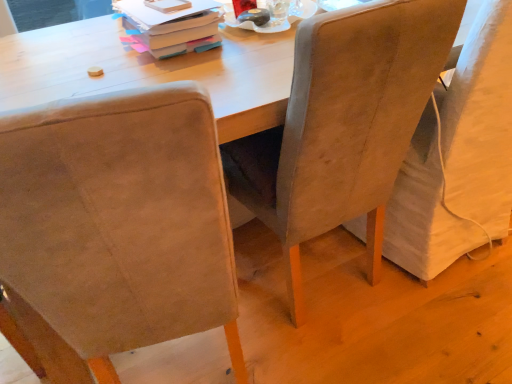
You are a GUI agent. You are given a task and a screenshot of the screen. Output one action in this format:
    pyautogui.click(x=<x>, y=<y>)
    Task: Click on the suede-like beige chair at left, placed as the 3th chair when sorted from right to left
    The height and width of the screenshot is (384, 512).
    Given the screenshot: What is the action you would take?
    click(x=116, y=227)

Measure the distance between matte cardboard book at upper center and camera.

3.70 feet.

What do you see at coordinates (481, 122) in the screenshot? I see `suede-like beige chair at right, which ranks as the third chair in left-to-right order` at bounding box center [481, 122].

Find the location of a particular element. suede-like beige chair at left, placed as the 3th chair when sorted from right to left is located at coordinates (116, 227).

From a real-world perspective, is suede-like beige chair at left, placed as the 3th chair when sorted from right to left, positioned over matte cardboard book at upper center based on gravity?

No.

Does suede-like beige chair at left, placed as the 3th chair when sorted from right to left, come in front of matte cardboard book at upper center?

Yes, suede-like beige chair at left, placed as the 3th chair when sorted from right to left, is in front of matte cardboard book at upper center.

You are a GUI agent. You are given a task and a screenshot of the screen. Output one action in this format:
    pyautogui.click(x=<x>, y=<y>)
    Task: Click on the book above the suede-like beige chair at left, placed as the 3th chair when sorted from right to left (from a real-world perspective)
    The image size is (512, 384).
    Given the screenshot: What is the action you would take?
    pyautogui.click(x=170, y=25)

Is matte cardboard book at upper center at the back of suede-like beige chair at left, placed as the 3th chair when sorted from right to left?

No, suede-like beige chair at left, placed as the 3th chair when sorted from right to left,'s orientation is not away from matte cardboard book at upper center.

From a real-world perspective, is suede-like beige chair at right, which ranks as the third chair in left-to-right order, above or below suede-like beige chair at left, placed as the 3th chair when sorted from right to left?

suede-like beige chair at right, which ranks as the third chair in left-to-right order, is situated lower than suede-like beige chair at left, placed as the 3th chair when sorted from right to left, in the real world.

Considering the relative sizes of suede-like beige chair at right, which is the 1th chair from right to left, and suede-like beige chair at left, placed as the 3th chair when sorted from right to left, in the image provided, is suede-like beige chair at right, which is the 1th chair from right to left, thinner than suede-like beige chair at left, placed as the 3th chair when sorted from right to left,?

Correct, the width of suede-like beige chair at right, which is the 1th chair from right to left, is less than that of suede-like beige chair at left, placed as the 3th chair when sorted from right to left.

Which is more to the left, suede-like beige chair at right, which is the 1th chair from right to left, or suede-like beige chair at left, placed as the 3th chair when sorted from right to left?

suede-like beige chair at left, placed as the 3th chair when sorted from right to left, is more to the left.

Considering the relative sizes of suede-like beige chair at right, which ranks as the third chair in left-to-right order, and suede-like beige chair at left, the first chair viewed from the left, in the image provided, is suede-like beige chair at right, which ranks as the third chair in left-to-right order, taller than suede-like beige chair at left, the first chair viewed from the left,?

Incorrect, the height of suede-like beige chair at right, which ranks as the third chair in left-to-right order, is not larger of that of suede-like beige chair at left, the first chair viewed from the left.

Which object is wider, matte cardboard book at upper center or suede-like beige chair at center, which is the second chair from right to left?

Wider between the two is suede-like beige chair at center, which is the second chair from right to left.

Can you tell me how much matte cardboard book at upper center and suede-like beige chair at center, which is the second chair from right to left, differ in facing direction?

matte cardboard book at upper center and suede-like beige chair at center, which is the second chair from right to left, are facing 4.24 degrees away from each other.

Which point is more distant from viewer, [128,3] or [346,175]?

The point [128,3] is more distant.

Consider the image. Is matte cardboard book at upper center looking in the opposite direction of suede-like beige chair at center, acting as the 2th chair starting from the left?

No.

Can you confirm if suede-like beige chair at right, which ranks as the third chair in left-to-right order, is positioned to the right of matte cardboard book at upper center?

Correct, you'll find suede-like beige chair at right, which ranks as the third chair in left-to-right order, to the right of matte cardboard book at upper center.

Based on the photo, who is bigger, suede-like beige chair at right, which is the 1th chair from right to left, or matte cardboard book at upper center?

suede-like beige chair at right, which is the 1th chair from right to left, is bigger.

Based on the photo, who is more distant, suede-like beige chair at right, which is the 1th chair from right to left, or matte cardboard book at upper center?

Positioned behind is matte cardboard book at upper center.

From a real-world perspective, between suede-like beige chair at right, which is the 1th chair from right to left, and suede-like beige chair at center, acting as the 2th chair starting from the left, who is vertically lower?

From a 3D spatial view, suede-like beige chair at right, which is the 1th chair from right to left, is below.

Could you tell me if suede-like beige chair at right, which ranks as the third chair in left-to-right order, is facing suede-like beige chair at center, which is the second chair from right to left?

No, suede-like beige chair at right, which ranks as the third chair in left-to-right order, is not turned towards suede-like beige chair at center, which is the second chair from right to left.

Is suede-like beige chair at right, which ranks as the third chair in left-to-right order, further to camera compared to suede-like beige chair at center, which is the second chair from right to left?

Yes, it is.

Which is farther, (477, 44) or (287, 283)?

Point (287, 283)

From a real-world perspective, is matte cardboard book at upper center under suede-like beige chair at right, which ranks as the third chair in left-to-right order?

No, from a real-world perspective, matte cardboard book at upper center is not beneath suede-like beige chair at right, which ranks as the third chair in left-to-right order.

In the scene shown: Considering the relative sizes of matte cardboard book at upper center and suede-like beige chair at right, which is the 1th chair from right to left, in the image provided, is matte cardboard book at upper center taller than suede-like beige chair at right, which is the 1th chair from right to left,?

Incorrect, the height of matte cardboard book at upper center is not larger of that of suede-like beige chair at right, which is the 1th chair from right to left.

Is matte cardboard book at upper center not within suede-like beige chair at right, which ranks as the third chair in left-to-right order?

Indeed, matte cardboard book at upper center is completely outside suede-like beige chair at right, which ranks as the third chair in left-to-right order.

Is suede-like beige chair at center, acting as the 2th chair starting from the left, positioned with its back to matte cardboard book at upper center?

No.

Which of these two, suede-like beige chair at center, acting as the 2th chair starting from the left, or matte cardboard book at upper center, stands shorter?

With less height is matte cardboard book at upper center.

From a real-world perspective, is suede-like beige chair at center, which is the second chair from right to left, positioned under matte cardboard book at upper center based on gravity?

Yes, from a real-world perspective, suede-like beige chair at center, which is the second chair from right to left, is below matte cardboard book at upper center.

How much distance is there between suede-like beige chair at center, acting as the 2th chair starting from the left, and matte cardboard book at upper center?

The distance of suede-like beige chair at center, acting as the 2th chair starting from the left, from matte cardboard book at upper center is 18.62 inches.

At what (x,y) coordinates should I click in order to perform the action: click on the 3rd chair in front of the matte cardboard book at upper center. Please return your answer as a coordinate pair (x, y). Looking at the image, I should click on (116, 227).

I want to click on the 2nd chair to the left of the suede-like beige chair at right, which is the 1th chair from right to left, counting from the anchor's position, so click(116, 227).

Looking at the image, which one is located further to suede-like beige chair at left, placed as the 3th chair when sorted from right to left, suede-like beige chair at center, which is the second chair from right to left, or matte cardboard book at upper center?

matte cardboard book at upper center.

Looking at the image, which one is located closer to matte cardboard book at upper center, suede-like beige chair at center, which is the second chair from right to left, or suede-like beige chair at right, which is the 1th chair from right to left?

Based on the image, suede-like beige chair at center, which is the second chair from right to left, appears to be nearer to matte cardboard book at upper center.

Based on their spatial positions, is matte cardboard book at upper center or suede-like beige chair at center, acting as the 2th chair starting from the left, further from suede-like beige chair at left, placed as the 3th chair when sorted from right to left?

matte cardboard book at upper center lies further to suede-like beige chair at left, placed as the 3th chair when sorted from right to left, than the other object.

Considering their positions, is suede-like beige chair at left, the first chair viewed from the left, positioned further to suede-like beige chair at center, which is the second chair from right to left, than matte cardboard book at upper center?

matte cardboard book at upper center.

Estimate the real-world distances between objects in this image. Which object is closer to suede-like beige chair at right, which is the 1th chair from right to left, matte cardboard book at upper center or suede-like beige chair at center, which is the second chair from right to left?

Based on the image, suede-like beige chair at center, which is the second chair from right to left, appears to be nearer to suede-like beige chair at right, which is the 1th chair from right to left.

Which object lies nearer to the anchor point suede-like beige chair at center, which is the second chair from right to left, suede-like beige chair at right, which is the 1th chair from right to left, or matte cardboard book at upper center?

suede-like beige chair at right, which is the 1th chair from right to left, is positioned closer to the anchor suede-like beige chair at center, which is the second chair from right to left.

When comparing their distances from suede-like beige chair at center, acting as the 2th chair starting from the left, does matte cardboard book at upper center or suede-like beige chair at right, which ranks as the third chair in left-to-right order, seem closer?

suede-like beige chair at right, which ranks as the third chair in left-to-right order.

When comparing their distances from matte cardboard book at upper center, does suede-like beige chair at right, which is the 1th chair from right to left, or suede-like beige chair at center, acting as the 2th chair starting from the left, seem closer?

A: The object closer to matte cardboard book at upper center is suede-like beige chair at center, acting as the 2th chair starting from the left.

Find the location of a particular element. chair between suede-like beige chair at left, placed as the 3th chair when sorted from right to left, and suede-like beige chair at right, which ranks as the third chair in left-to-right order, in the horizontal direction is located at coordinates (343, 124).